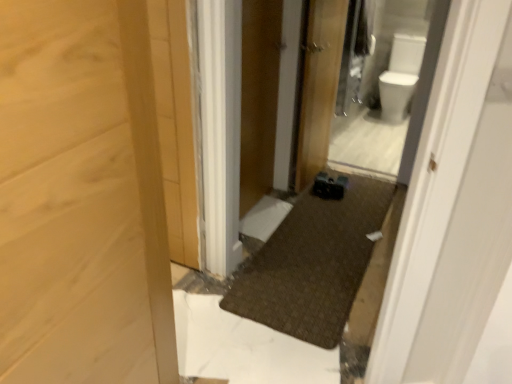
Question: Do you think wooden door at center is within wooden screen door at center, or outside of it?

Choices:
 (A) outside
 (B) inside

Answer: (A)

Question: In terms of size, does wooden door at center appear bigger or smaller than wooden screen door at center?

Choices:
 (A) small
 (B) big

Answer: (B)

Question: Which is farther from the wooden door at center?

Choices:
 (A) wooden screen door at center
 (B) white glossy toilet bowl at upper right

Answer: (B)

Question: Considering the real-world distances, which object is closest to the white glossy toilet bowl at upper right?

Choices:
 (A) wooden screen door at center
 (B) wooden door at center

Answer: (B)